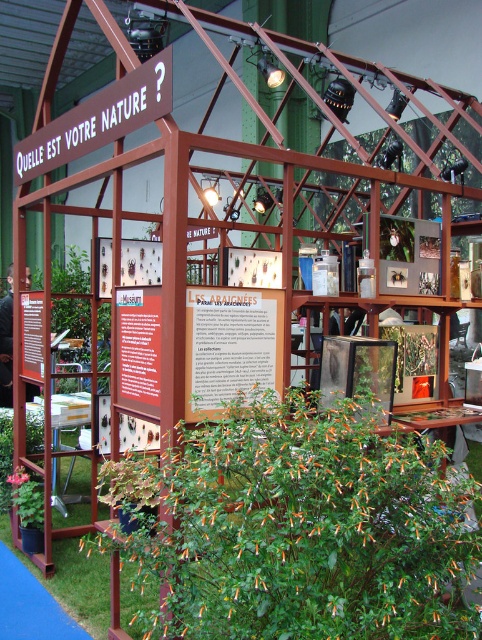
You are standing in the museum exhibit and need to locate both the wooden sign at center and the green leafy plant at lower left. From your current position, which object is positioned to the right of the other?

The wooden sign at center is to the right of the green leafy plant at lower left, so the wooden sign at center is positioned to the right of the green leafy plant at lower left.

You are standing at the entrance of the wooden pavilion and notice the green leafy plant at lower center. Based on its coordinates, can you determine if it is positioned closer to the front or the back of the pavilion?

The green leafy plant at lower center is located at point (295, 528). Since the coordinates are closer to 1 on both axes, it is positioned closer to the back of the pavilion.